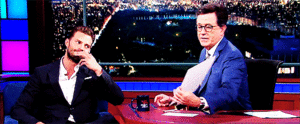
Where is `paper on the desk of the man at the main desk to the far right`? This screenshot has width=300, height=124. paper on the desk of the man at the main desk to the far right is located at coordinates (271, 116).